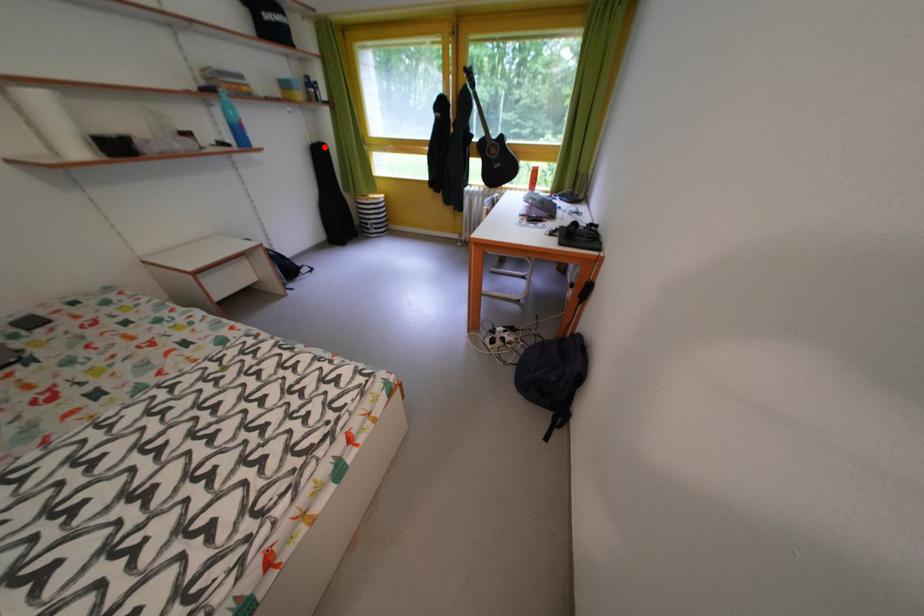
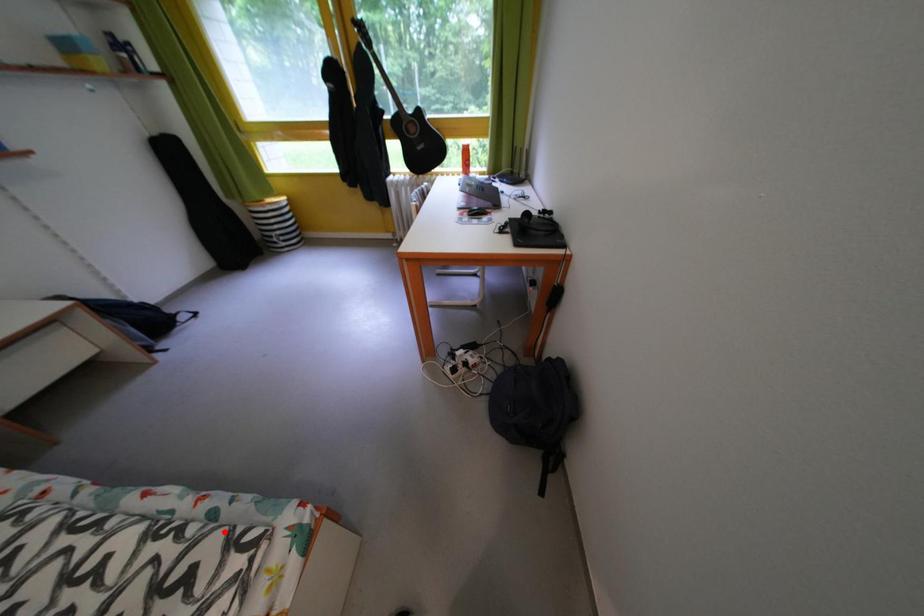
From the picture: I am providing you with two images of the same scene from different viewpoints. A red point is marked on the first image and another point is marked on the second image. Is the red point in image1 aligned with the point shown in image2?

No